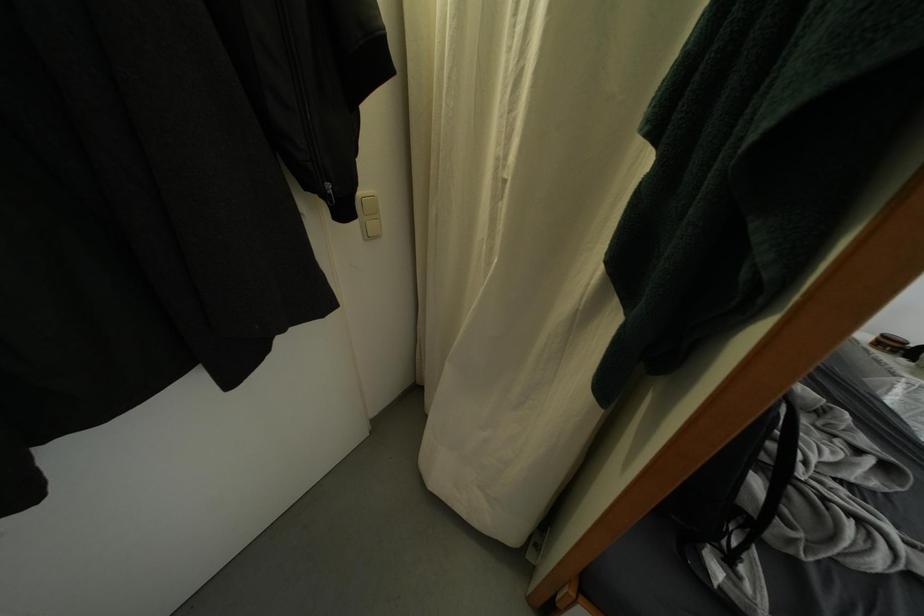
Locate an element on the screen. This screenshot has height=616, width=924. black bag strap is located at coordinates (781, 468).